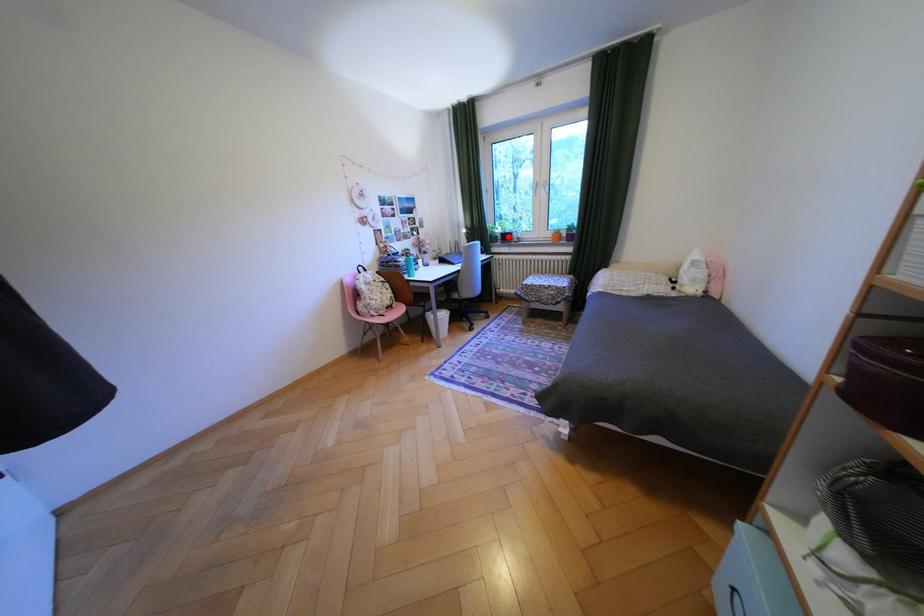
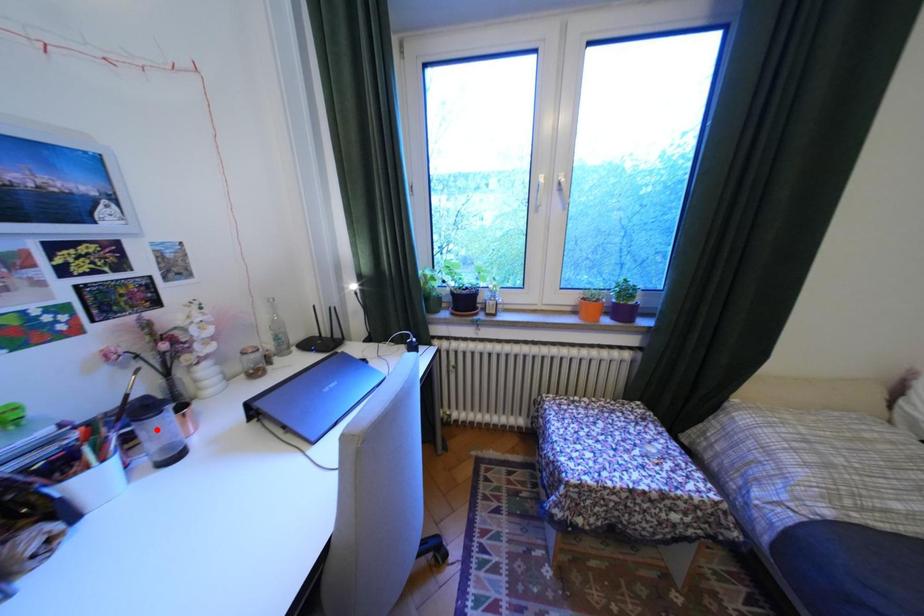
I am providing you with two images of the same scene from different viewpoints. A red point is marked on the first image and another point is marked on the second image. Is the marked point in image1 the same physical position as the marked point in image2?

No